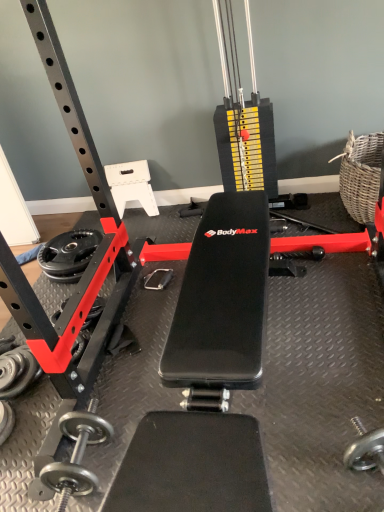
Consider the image. Measure the distance between point (372, 205) and camera.

Point (372, 205) is 1.80 meters from camera.

Locate an element on the screen. The width and height of the screenshot is (384, 512). woven natural basket at right is located at coordinates (361, 175).

At what (x,y) coordinates should I click in order to perform the action: click on black rubber dumbbell at lower left, which is the 2th dumbbell from bottom to top. Please return your answer as a coordinate pair (x, y). Looking at the image, I should click on (17, 371).

This screenshot has width=384, height=512. I want to click on black rubber weight plate at lower left, so click(68, 255).

Describe the element at coordinates (6, 421) in the screenshot. I see `silver metallic dumbbell at lower left, the second dumbbell in the top-to-bottom sequence` at that location.

In order to click on woven natural basket at right in this screenshot , I will do `click(361, 175)`.

How much distance is there between black rubber dumbbell at lower left, which is the 2th dumbbell from bottom to top, and black rubber weight plate at lower left?

black rubber dumbbell at lower left, which is the 2th dumbbell from bottom to top, and black rubber weight plate at lower left are 21.85 inches apart from each other.

Is there a large distance between black rubber dumbbell at lower left, acting as the 1th dumbbell starting from the top, and black rubber weight plate at lower left?

No, black rubber dumbbell at lower left, acting as the 1th dumbbell starting from the top, is not far from black rubber weight plate at lower left.

In the scene shown: Which object is closer to the camera, black rubber dumbbell at lower left, which is the 2th dumbbell from bottom to top, or black rubber weight plate at lower left?

black rubber dumbbell at lower left, which is the 2th dumbbell from bottom to top, is in front.

Is black rubber weight plate at lower left a part of black rubber dumbbell at lower left, acting as the 1th dumbbell starting from the top?

Definitely not — black rubber weight plate at lower left is not inside black rubber dumbbell at lower left, acting as the 1th dumbbell starting from the top.

How different are the orientations of woven natural basket at right and silver metallic dumbbell at lower left, the second dumbbell in the top-to-bottom sequence, in degrees?

The angular difference between woven natural basket at right and silver metallic dumbbell at lower left, the second dumbbell in the top-to-bottom sequence, is 3.03 degrees.

Is woven natural basket at right completely or partially outside of silver metallic dumbbell at lower left, the second dumbbell in the top-to-bottom sequence?

Indeed, woven natural basket at right is completely outside silver metallic dumbbell at lower left, the second dumbbell in the top-to-bottom sequence.

Can you confirm if woven natural basket at right is thinner than silver metallic dumbbell at lower left, the first dumbbell positioned from the bottom?

No, woven natural basket at right is not thinner than silver metallic dumbbell at lower left, the first dumbbell positioned from the bottom.

Who is taller, woven natural basket at right or silver metallic dumbbell at lower left, the second dumbbell in the top-to-bottom sequence?

woven natural basket at right.

Based on their positions, is black rubber weight plate at lower left located to the left or right of black rubber dumbbell at lower left, which is the 2th dumbbell from bottom to top?

black rubber weight plate at lower left is positioned on black rubber dumbbell at lower left, which is the 2th dumbbell from bottom to top,'s right side.

Is black rubber weight plate at lower left not near black rubber dumbbell at lower left, acting as the 1th dumbbell starting from the top?

black rubber weight plate at lower left is actually quite close to black rubber dumbbell at lower left, acting as the 1th dumbbell starting from the top.

From a real-world perspective, is black rubber weight plate at lower left positioned over black rubber dumbbell at lower left, which is the 2th dumbbell from bottom to top, based on gravity?

Actually, black rubber weight plate at lower left is physically below black rubber dumbbell at lower left, which is the 2th dumbbell from bottom to top, in the real world.

How different are the orientations of black rubber weight plate at lower left and black rubber dumbbell at lower left, which is the 2th dumbbell from bottom to top, in degrees?

The angular difference between black rubber weight plate at lower left and black rubber dumbbell at lower left, which is the 2th dumbbell from bottom to top, is 93.3 degrees.

Looking at this image, is woven natural basket at right behind black rubber weight plate at lower left?

That is False.

Where is `basket located in front of the black rubber weight plate at lower left`? Image resolution: width=384 pixels, height=512 pixels. basket located in front of the black rubber weight plate at lower left is located at coordinates (361, 175).

Can you confirm if woven natural basket at right is thinner than black rubber weight plate at lower left?

No.

Which of these two, black rubber dumbbell at lower left, acting as the 1th dumbbell starting from the top, or woven natural basket at right, stands taller?

Standing taller between the two is woven natural basket at right.

Is black rubber dumbbell at lower left, which is the 2th dumbbell from bottom to top, with woven natural basket at right?

No, black rubber dumbbell at lower left, which is the 2th dumbbell from bottom to top, is not touching woven natural basket at right.

From a real-world perspective, is black rubber dumbbell at lower left, acting as the 1th dumbbell starting from the top, positioned above or below woven natural basket at right?

In terms of real-world spatial position, black rubber dumbbell at lower left, acting as the 1th dumbbell starting from the top, is below woven natural basket at right.

Which object is thinner, black rubber dumbbell at lower left, which is the 2th dumbbell from bottom to top, or woven natural basket at right?

With smaller width is black rubber dumbbell at lower left, which is the 2th dumbbell from bottom to top.

Is silver metallic dumbbell at lower left, the second dumbbell in the top-to-bottom sequence, turned away from black rubber weight plate at lower left?

Correct, silver metallic dumbbell at lower left, the second dumbbell in the top-to-bottom sequence, is looking away from black rubber weight plate at lower left.

Looking at this image, which object is wider, silver metallic dumbbell at lower left, the first dumbbell positioned from the bottom, or black rubber weight plate at lower left?

With larger width is black rubber weight plate at lower left.

Does point (8, 408) appear closer or farther from the camera than point (63, 258)?

Point (8, 408) is closer to the camera than point (63, 258).

Can you confirm if silver metallic dumbbell at lower left, the first dumbbell positioned from the bottom, is positioned to the left of black rubber weight plate at lower left?

Correct, you'll find silver metallic dumbbell at lower left, the first dumbbell positioned from the bottom, to the left of black rubber weight plate at lower left.

Does point (97, 231) come closer to viewer compared to point (0, 424)?

No, (97, 231) is behind (0, 424).

Which object is closer to the camera, black rubber weight plate at lower left or silver metallic dumbbell at lower left, the first dumbbell positioned from the bottom?

silver metallic dumbbell at lower left, the first dumbbell positioned from the bottom, is more forward.

From the image's perspective, between black rubber weight plate at lower left and silver metallic dumbbell at lower left, the first dumbbell positioned from the bottom, which one is located above?

From the image's view, black rubber weight plate at lower left is above.

Are black rubber weight plate at lower left and silver metallic dumbbell at lower left, the second dumbbell in the top-to-bottom sequence, located far from each other?

No, black rubber weight plate at lower left is not far from silver metallic dumbbell at lower left, the second dumbbell in the top-to-bottom sequence.

Where is `wheel behind the black rubber dumbbell at lower left, acting as the 1th dumbbell starting from the top`? This screenshot has height=512, width=384. wheel behind the black rubber dumbbell at lower left, acting as the 1th dumbbell starting from the top is located at coordinates (68, 255).

Find the location of a particular element. The width and height of the screenshot is (384, 512). basket that is on the right side of silver metallic dumbbell at lower left, the second dumbbell in the top-to-bottom sequence is located at coordinates (361, 175).

From the image, which object appears to be nearer to silver metallic dumbbell at lower left, the first dumbbell positioned from the bottom, woven natural basket at right or black rubber dumbbell at lower left, which is the 2th dumbbell from bottom to top?

The object closer to silver metallic dumbbell at lower left, the first dumbbell positioned from the bottom, is black rubber dumbbell at lower left, which is the 2th dumbbell from bottom to top.

Estimate the real-world distances between objects in this image. Which object is closer to black rubber weight plate at lower left, woven natural basket at right or black rubber dumbbell at lower left, which is the 2th dumbbell from bottom to top?

Among the two, black rubber dumbbell at lower left, which is the 2th dumbbell from bottom to top, is located nearer to black rubber weight plate at lower left.

Considering their positions, is silver metallic dumbbell at lower left, the first dumbbell positioned from the bottom, positioned further to black rubber dumbbell at lower left, acting as the 1th dumbbell starting from the top, than black rubber weight plate at lower left?

black rubber weight plate at lower left lies further to black rubber dumbbell at lower left, acting as the 1th dumbbell starting from the top, than the other object.

Estimate the real-world distances between objects in this image. Which object is closer to woven natural basket at right, black rubber dumbbell at lower left, which is the 2th dumbbell from bottom to top, or silver metallic dumbbell at lower left, the second dumbbell in the top-to-bottom sequence?

black rubber dumbbell at lower left, which is the 2th dumbbell from bottom to top, is closer to woven natural basket at right.

Considering their positions, is silver metallic dumbbell at lower left, the first dumbbell positioned from the bottom, positioned further to black rubber dumbbell at lower left, which is the 2th dumbbell from bottom to top, than woven natural basket at right?

woven natural basket at right lies further to black rubber dumbbell at lower left, which is the 2th dumbbell from bottom to top, than the other object.

Considering their positions, is woven natural basket at right positioned further to black rubber weight plate at lower left than silver metallic dumbbell at lower left, the first dumbbell positioned from the bottom?

Among the two, woven natural basket at right is located further to black rubber weight plate at lower left.

Estimate the real-world distances between objects in this image. Which object is further from black rubber weight plate at lower left, silver metallic dumbbell at lower left, the second dumbbell in the top-to-bottom sequence, or woven natural basket at right?

woven natural basket at right is further to black rubber weight plate at lower left.

When comparing their distances from woven natural basket at right, does black rubber weight plate at lower left or silver metallic dumbbell at lower left, the first dumbbell positioned from the bottom, seem further?

silver metallic dumbbell at lower left, the first dumbbell positioned from the bottom.

This screenshot has width=384, height=512. What are the coordinates of `wheel between silver metallic dumbbell at lower left, the second dumbbell in the top-to-bottom sequence, and woven natural basket at right from left to right` in the screenshot? It's located at [68, 255].

The height and width of the screenshot is (512, 384). What are the coordinates of `dumbbell between silver metallic dumbbell at lower left, the first dumbbell positioned from the bottom, and black rubber weight plate at lower left, along the z-axis` in the screenshot? It's located at (17, 371).

Find the location of `dumbbell located between silver metallic dumbbell at lower left, the second dumbbell in the top-to-bottom sequence, and woven natural basket at right in the left-right direction`. dumbbell located between silver metallic dumbbell at lower left, the second dumbbell in the top-to-bottom sequence, and woven natural basket at right in the left-right direction is located at coordinates (17, 371).

Where is `wheel between black rubber dumbbell at lower left, acting as the 1th dumbbell starting from the top, and woven natural basket at right from left to right`? The image size is (384, 512). wheel between black rubber dumbbell at lower left, acting as the 1th dumbbell starting from the top, and woven natural basket at right from left to right is located at coordinates (68, 255).